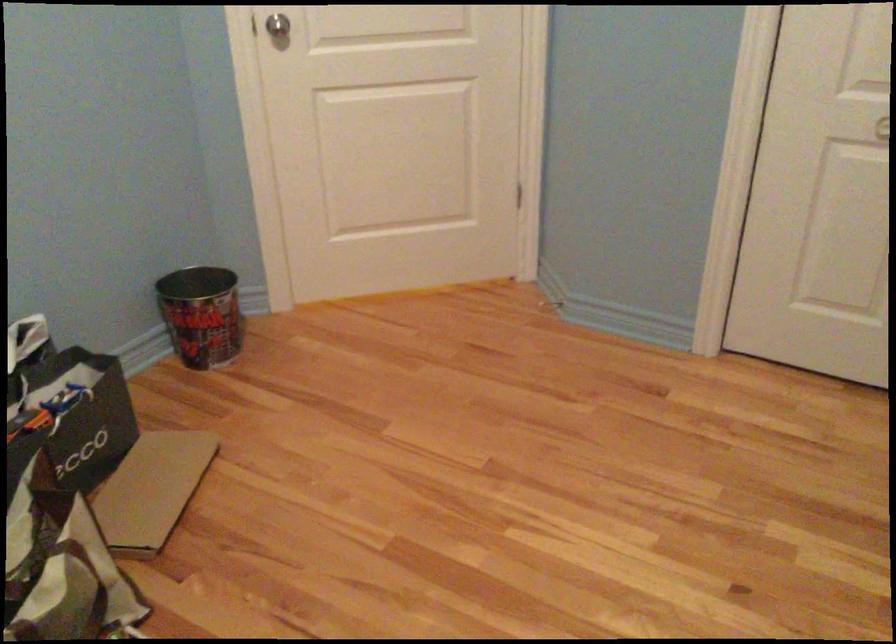
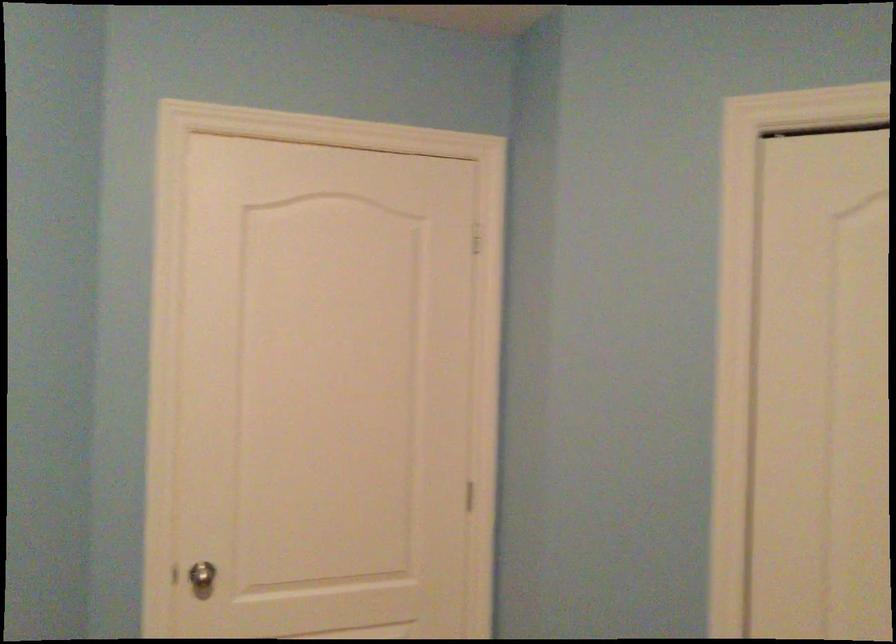
Question: The images are taken continuously from a first-person perspective. In which direction is your viewpoint rotating?

Choices:
 (A) Left
 (B) Right
 (C) Up
 (D) Down

Answer: (C)